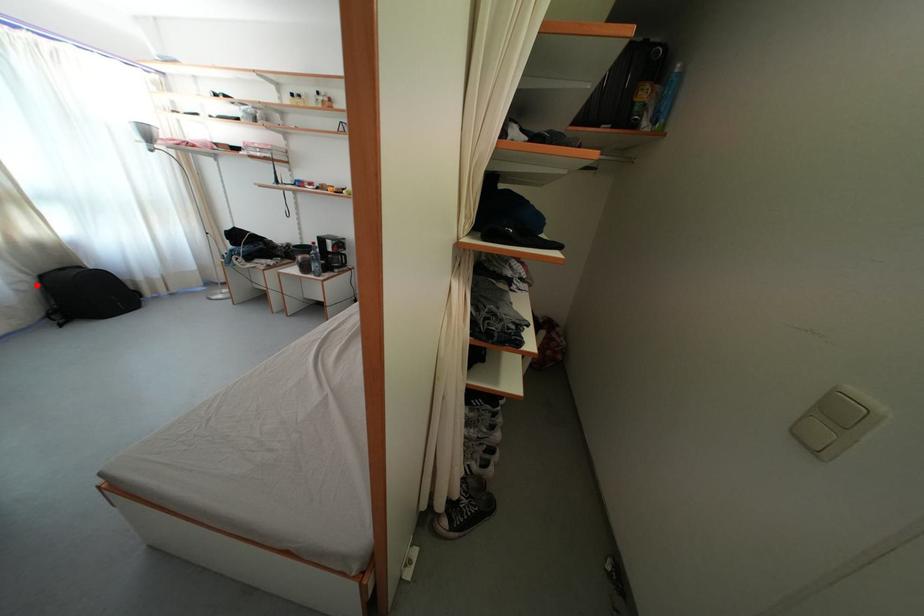
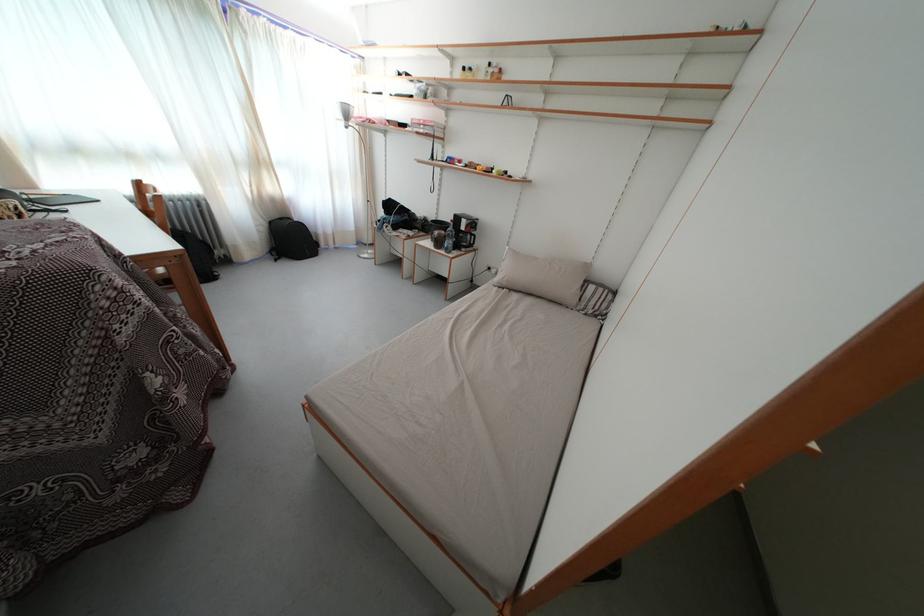
Question: I am providing you with two images of the same scene from different viewpoints. Image1 has a red point marked. In image2, the corresponding 3D location appears at what relative position? Reply with the corresponding letter.

Choices:
 (A) Closer
 (B) Farther

Answer: (A)